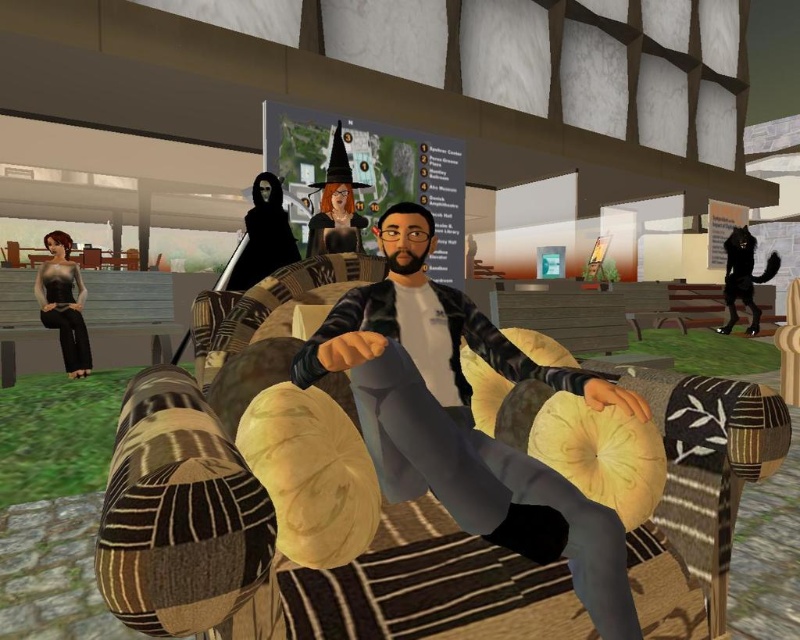
The height and width of the screenshot is (640, 800). What do you see at coordinates (466, 419) in the screenshot? I see `matte gray sweater at center` at bounding box center [466, 419].

Who is shorter, matte gray sweater at center or black furry cat at upper right?

matte gray sweater at center

Does point (520, 488) come closer to viewer compared to point (741, 275)?

Yes, it is.

At what (x,y) coordinates should I click in order to perform the action: click on matte gray sweater at center. Please return your answer as a coordinate pair (x, y). Looking at the image, I should click on (466, 419).

Who is more forward, (x=62, y=278) or (x=736, y=236)?

Point (x=62, y=278)

Is point (66, 246) less distant than point (724, 285)?

Yes, it is.

Find the location of a particular element. This screenshot has width=800, height=640. matte black dress at left is located at coordinates (64, 301).

Can you confirm if matte gray sweater at center is taller than matte black dress at left?

Incorrect, matte gray sweater at center's height is not larger of matte black dress at left's.

Does matte gray sweater at center appear over matte black dress at left?

Incorrect, matte gray sweater at center is not positioned above matte black dress at left.

Is point (552, 499) farther from viewer compared to point (61, 268)?

No, it is in front of (61, 268).

This screenshot has height=640, width=800. Find the location of `matte gray sweater at center`. matte gray sweater at center is located at coordinates (466, 419).